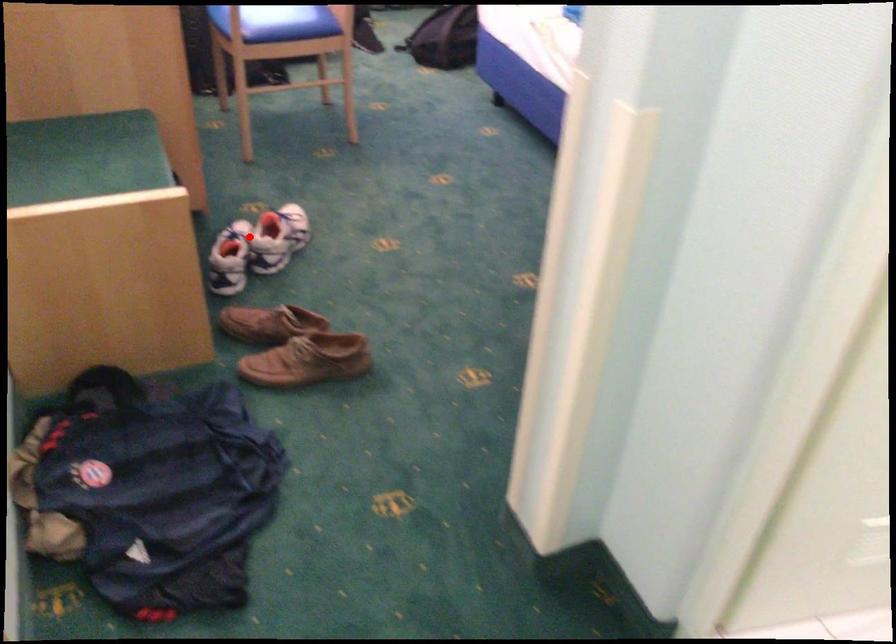
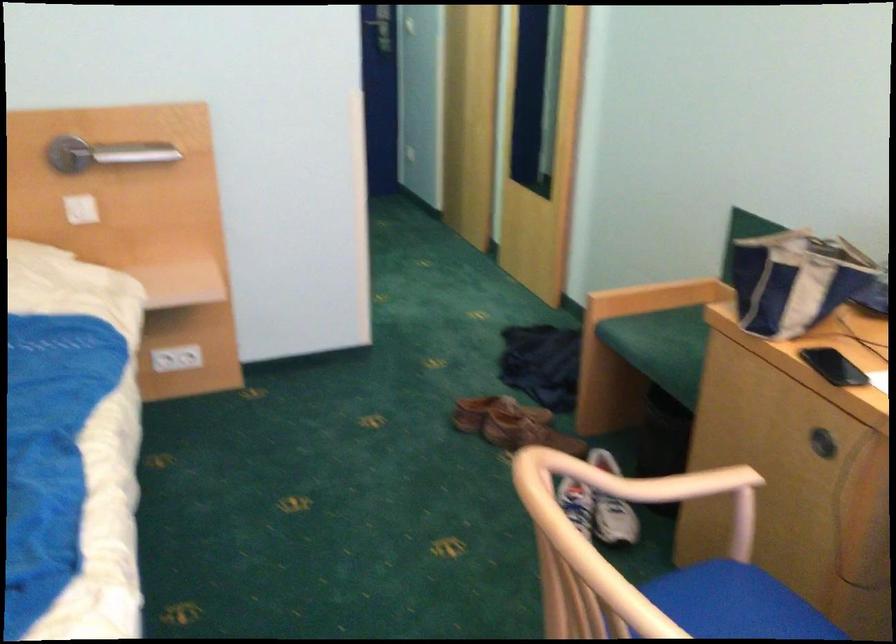
Question: I am providing you with two images of the same scene from different viewpoints. A red point is shown in image1. For the corresponding object point in image2, is it positioned nearer or farther from the camera?

Choices:
 (A) Nearer
 (B) Farther

Answer: (A)